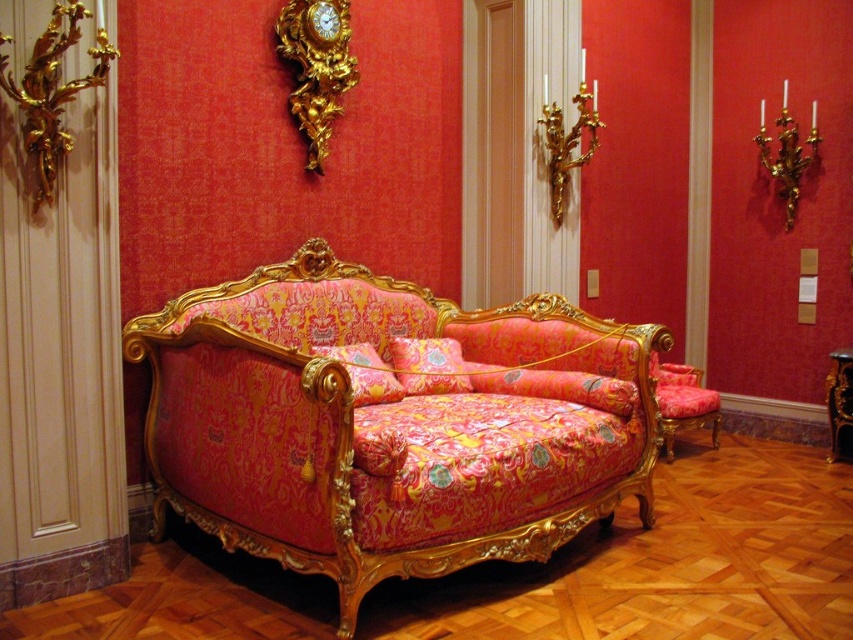
Looking at this image, you are an interior designer assessing the space between the gold ornate clock at upper center and the velvet floral armchair at center. If you want to place a decorative shelf between them, which object should the shelf be placed closer to to ensure it fits within the available space?

The gold ornate clock at upper center has a smaller width than the velvet floral armchair at center, so the shelf should be placed closer to the gold ornate clock at upper center to accommodate the narrower space.

You are an interior designer assessing the space for a client who prefers seating options with a lower profile. Which of the two items, the matte pink fabric couch at center or the velvet floral armchair at center, would you recommend based on their height?

The velvet floral armchair at center is shorter than the matte pink fabric couch at center, so it would be the better recommendation for a lower profile seating option.